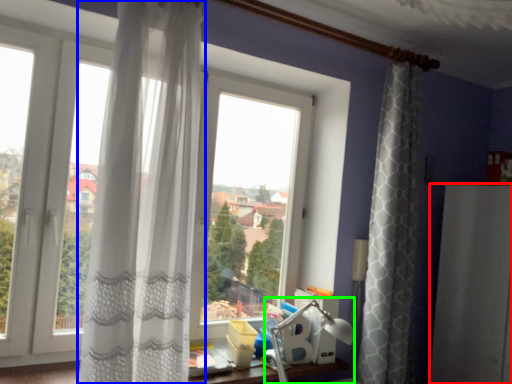
Question: Considering the real-world distances, which object is closest to screen door (highlighted by a red box)? curtain (highlighted by a blue box) or table lamp (highlighted by a green box).

Choices:
 (A) curtain
 (B) table lamp

Answer: (B)